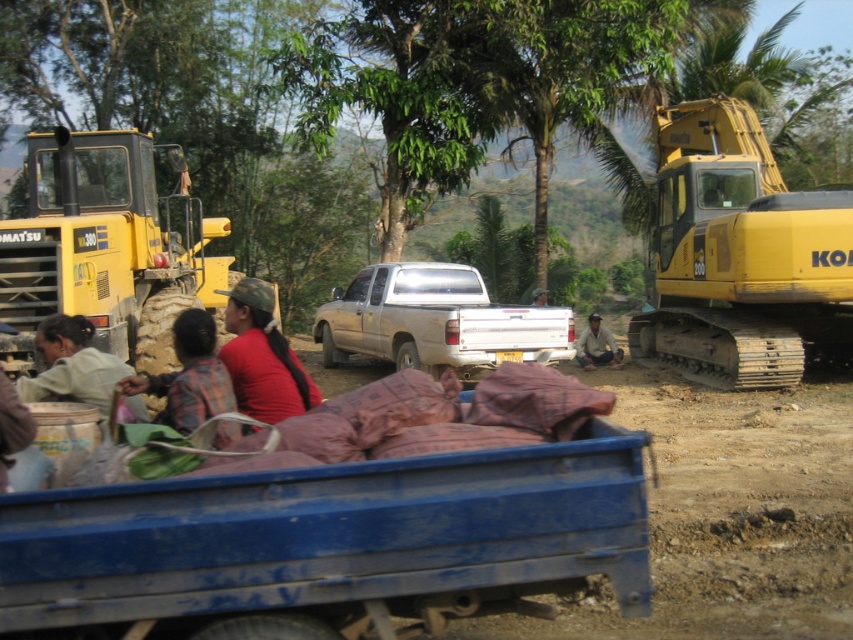
Is yellow metallic excavator at right closer to the viewer compared to brown fabric at center?

Yes, yellow metallic excavator at right is in front of brown fabric at center.

Does yellow metallic excavator at right have a lesser height compared to brown fabric at center?

Yes.

This screenshot has height=640, width=853. What are the coordinates of `yellow metallic excavator at right` in the screenshot? It's located at (741, 257).

The width and height of the screenshot is (853, 640). I want to click on yellow metallic excavator at right, so (741, 257).

Based on the photo, can you confirm if plaid fabric shirt at center is wider than brown fabric at center?

No.

Which is more to the right, plaid fabric shirt at center or brown fabric at center?

Positioned to the right is brown fabric at center.

Where is `plaid fabric shirt at center`? This screenshot has width=853, height=640. plaid fabric shirt at center is located at coordinates (189, 376).

Is blue plastic cart at lower center further to camera compared to brown fabric at center?

No, blue plastic cart at lower center is closer to the viewer.

Locate an element on the screen. The image size is (853, 640). blue plastic cart at lower center is located at coordinates (329, 544).

Is point (618, 454) behind point (611, 340)?

No, (618, 454) is in front of (611, 340).

Image resolution: width=853 pixels, height=640 pixels. I want to click on blue plastic cart at lower center, so click(329, 544).